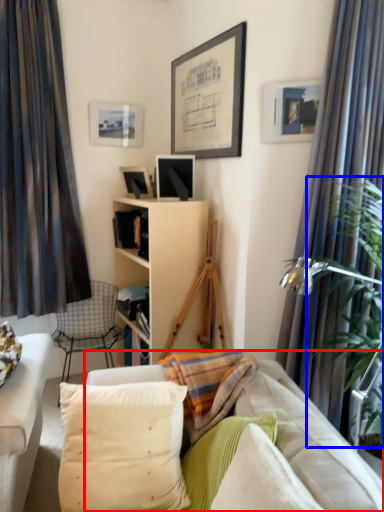
Question: Which object is closer to the camera taking this photo, studio couch (highlighted by a red box) or plant (highlighted by a blue box)?

Choices:
 (A) studio couch
 (B) plant

Answer: (A)